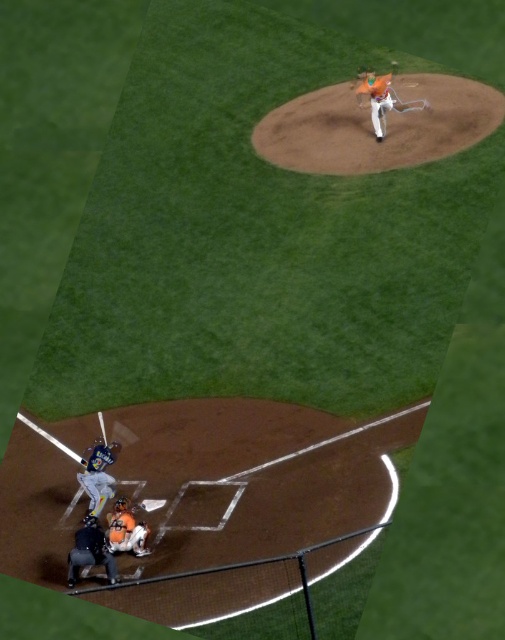
Question: Among these points, which one is farthest from the camera?

Choices:
 (A) (97, 416)
 (B) (83, 561)
 (C) (107, 445)

Answer: (A)

Question: Does orange helmeted umpire at lower left appear under brown leather glove at lower left?

Choices:
 (A) no
 (B) yes

Answer: (B)

Question: Is orange helmeted umpire at lower left thinner than brown leather glove at lower left?

Choices:
 (A) no
 (B) yes

Answer: (A)

Question: Which point is closer to the camera taking this photo?

Choices:
 (A) (93, 445)
 (B) (118, 445)
 (C) (84, 522)
 (D) (377, 120)

Answer: (C)

Question: Which object appears farthest from the camera in this image?

Choices:
 (A) brown leather glove at lower left
 (B) gray matte uniform at lower left
 (C) metallic bat at lower left

Answer: (C)

Question: Can you confirm if gray matte uniform at lower left is wider than orange matte catcher at lower center?

Choices:
 (A) yes
 (B) no

Answer: (A)